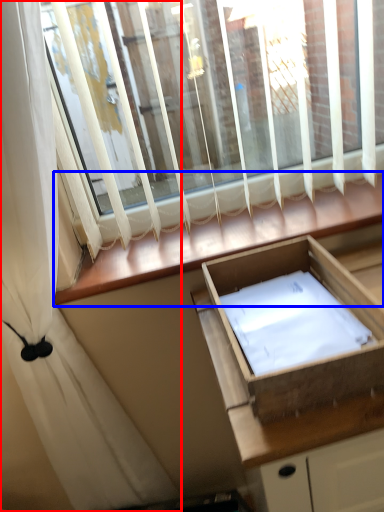
Question: Which of the following is the farthest to the observer, curtain (highlighted by a red box) or window sill (highlighted by a blue box)?

Choices:
 (A) curtain
 (B) window sill

Answer: (B)